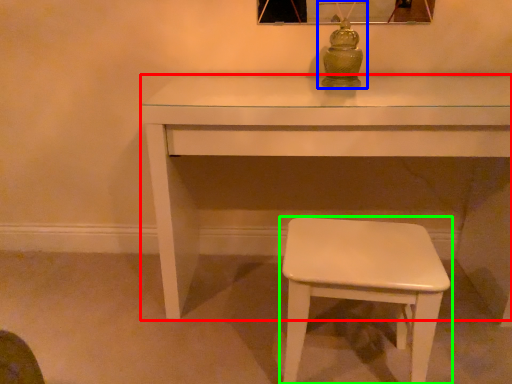
Question: Considering the real-world distances, which object is farthest from table (highlighted by a red box)? table lamp (highlighted by a blue box) or stool (highlighted by a green box)?

Choices:
 (A) table lamp
 (B) stool

Answer: (B)